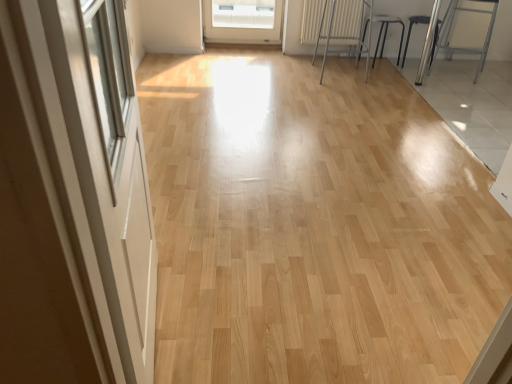
Locate an element on the screen. free spot below white glossy screen door at left (from a real-world perspective) is located at coordinates (162, 322).